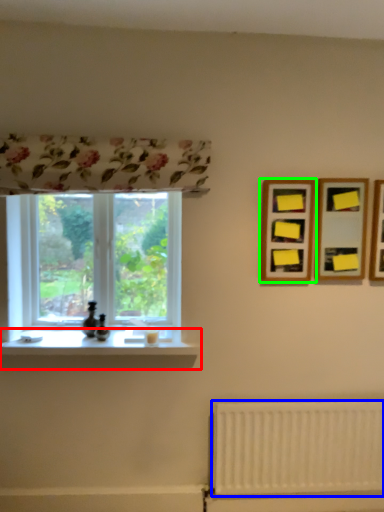
Question: Based on their relative distances, which object is farther from window sill (highlighted by a red box)? Choose from radiator (highlighted by a blue box) and picture frame (highlighted by a green box).

Choices:
 (A) radiator
 (B) picture frame

Answer: (B)